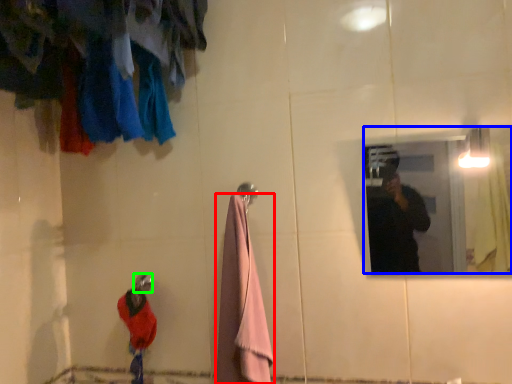
Question: Considering the real-world distances, which object is farthest from towel/napkin (highlighted by a red box)? mirror (highlighted by a blue box) or shower (highlighted by a green box)?

Choices:
 (A) mirror
 (B) shower

Answer: (A)